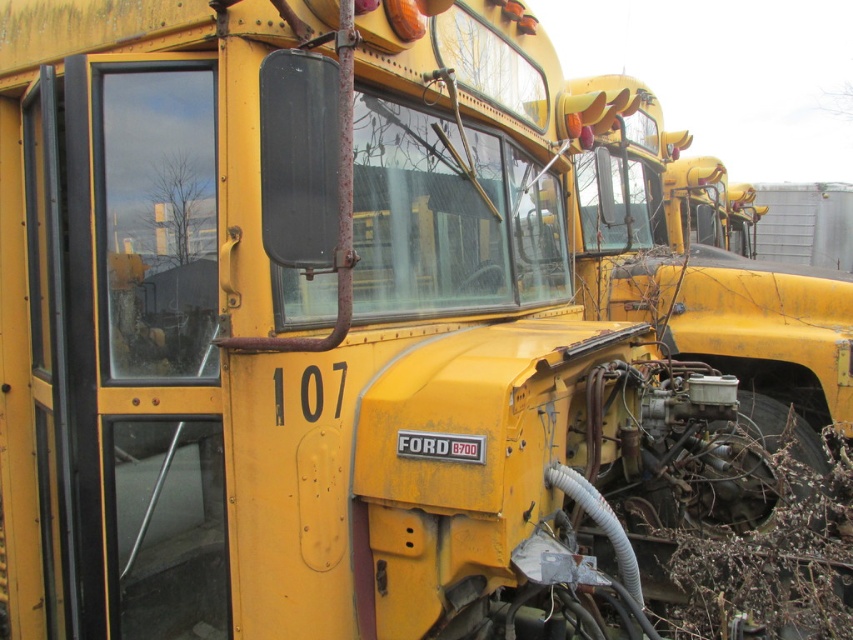
You are a mechanic inspecting the school buses. You notice two objects near the bus in the foreground. One is a brown fibrous weed at lower right and the other is a yellow matte license plate at center. Which object is bigger in size?

The brown fibrous weed at lower right is larger in size than the yellow matte license plate at center.

You are a mechanic inspecting the yellow school bus with license plate at center. You notice a brown fibrous weed at lower right. Where is the brown fibrous weed in relation to the yellow matte license plate at center?

The brown fibrous weed at lower right is located below the yellow matte license plate at center.